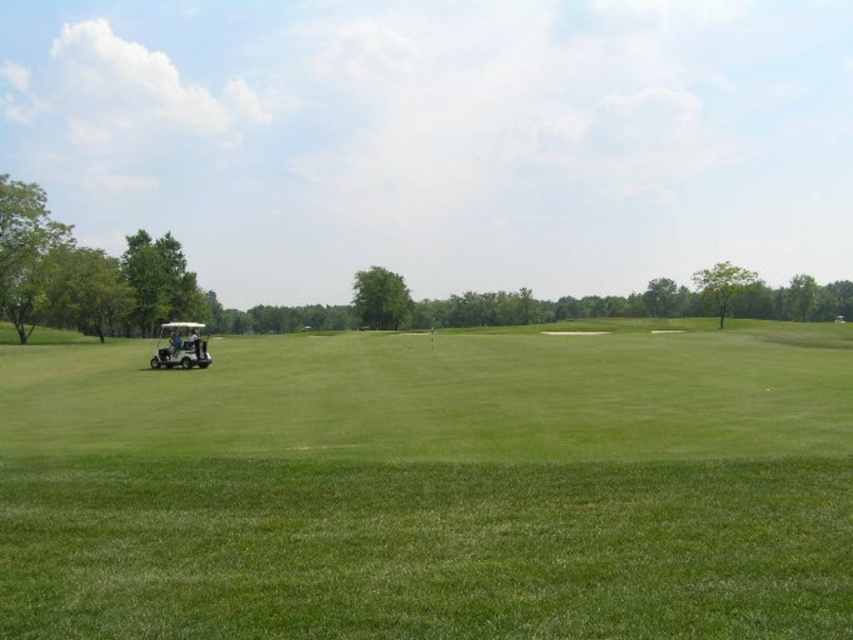
Question: Which point is closer to the camera?

Choices:
 (A) (180, 355)
 (B) (616, 467)

Answer: (B)

Question: Is green smooth grass at center to the left of white matte golf cart at left from the viewer's perspective?

Choices:
 (A) no
 (B) yes

Answer: (A)

Question: Does green smooth grass at center come behind white matte golf cart at left?

Choices:
 (A) no
 (B) yes

Answer: (A)

Question: Among these points, which one is farthest from the camera?

Choices:
 (A) (795, 564)
 (B) (198, 337)

Answer: (B)

Question: Observing the image, what is the correct spatial positioning of green smooth grass at center in reference to white matte golf cart at left?

Choices:
 (A) below
 (B) above

Answer: (A)

Question: Which of the following is the farthest from the observer?

Choices:
 (A) green smooth grass at center
 (B) white matte golf cart at left

Answer: (B)